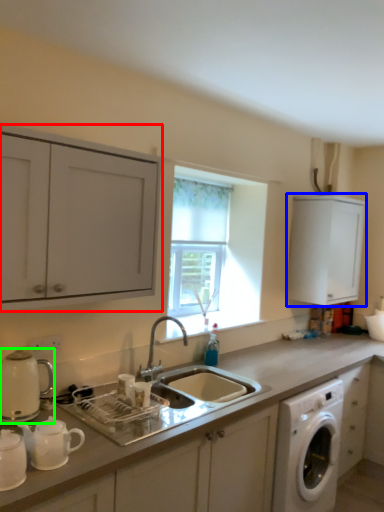
Question: Which object is the farthest from cabinetry (highlighted by a red box)? Choose among these: cabinetry (highlighted by a blue box) or appliance (highlighted by a green box).

Choices:
 (A) cabinetry
 (B) appliance

Answer: (A)